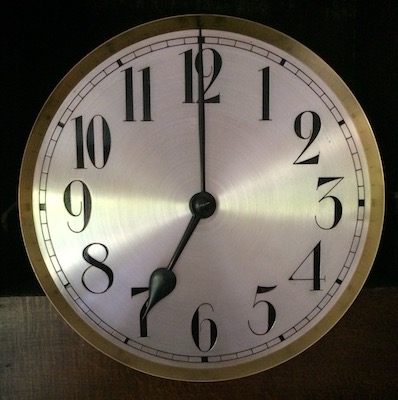
I want to click on minute hand of clock, so click(x=202, y=151).